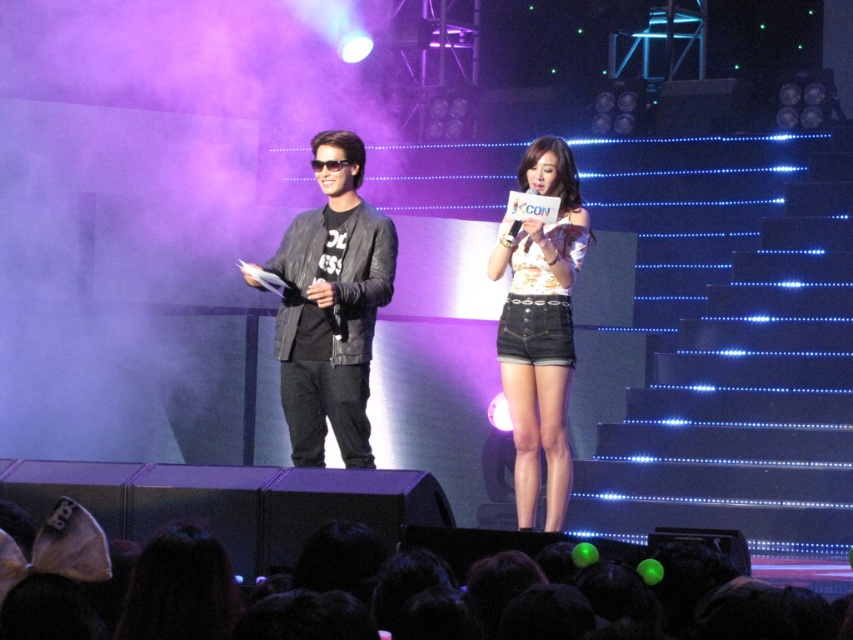
Question: Which is nearer to the leather jacket at center?

Choices:
 (A) floral fabric top at center
 (B) denim shorts at center

Answer: (A)

Question: Can you confirm if denim shorts at center is wider than leather jacket at center?

Choices:
 (A) no
 (B) yes

Answer: (A)

Question: From the image, what is the correct spatial relationship of leather jacket at center in relation to floral fabric top at center?

Choices:
 (A) below
 (B) above

Answer: (B)

Question: Is leather jacket at center smaller than floral fabric top at center?

Choices:
 (A) yes
 (B) no

Answer: (B)

Question: Estimate the real-world distances between objects in this image. Which object is closer to the floral fabric top at center?

Choices:
 (A) denim shorts at center
 (B) leather jacket at center

Answer: (B)

Question: Based on their relative distances, which object is nearer to the leather jacket at center?

Choices:
 (A) denim shorts at center
 (B) floral fabric top at center

Answer: (B)